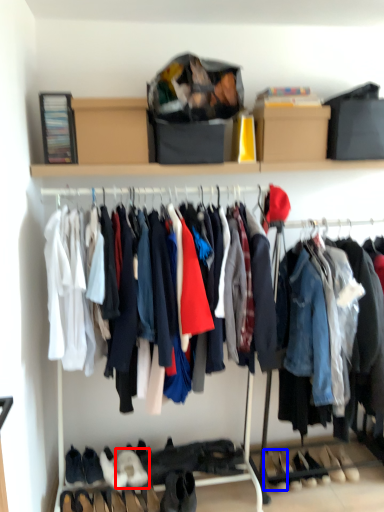
Question: Among these objects, which one is farthest to the camera, footwear (highlighted by a red box) or shoe (highlighted by a blue box)?

Choices:
 (A) footwear
 (B) shoe

Answer: (B)